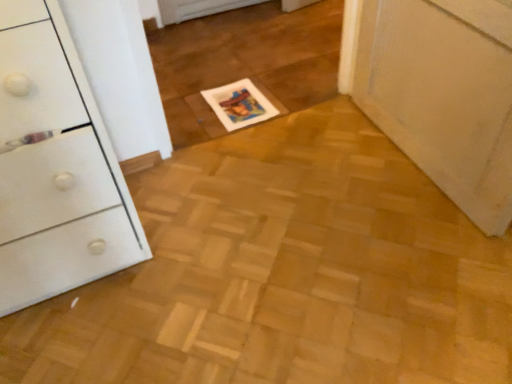
Locate an element on the screen. vacant area that is in front of white glossy chest of drawers at left is located at coordinates (96, 337).